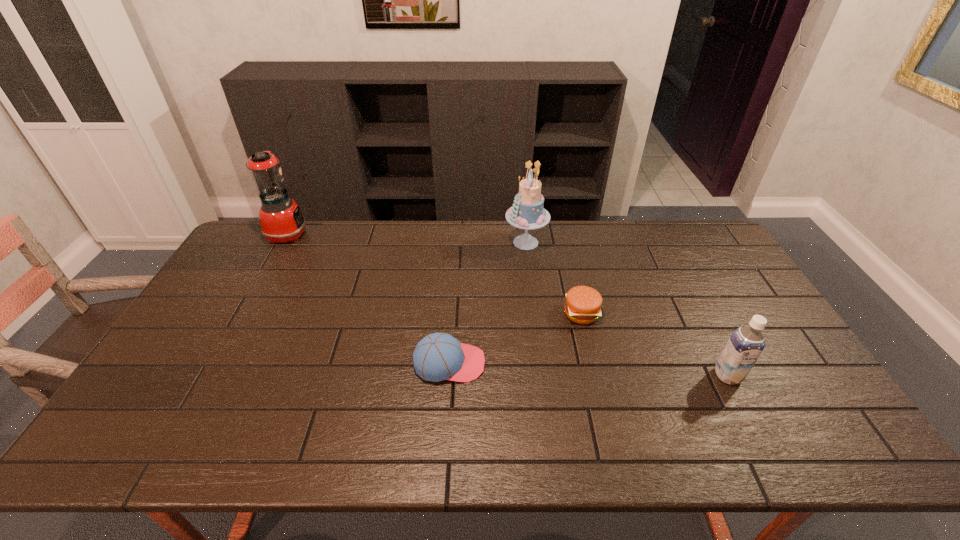
Locate an element on the screen. This screenshot has width=960, height=540. empty location between the third object from left to right and the shortest object is located at coordinates (554, 278).

Identify the location of free area in between the cake and the soya milk. The width and height of the screenshot is (960, 540). (627, 309).

Where is `free space between the leftmost object and the hamburger`? The height and width of the screenshot is (540, 960). free space between the leftmost object and the hamburger is located at coordinates pyautogui.click(x=435, y=273).

Locate an element on the screen. The height and width of the screenshot is (540, 960). vacant space that is in between the second object from left to right and the cake is located at coordinates (488, 303).

Where is `object that can be found as the third closest to the baseball cap`? This screenshot has height=540, width=960. object that can be found as the third closest to the baseball cap is located at coordinates 745,345.

Identify which object is the second closest to the fourth object from right to left. Please provide its 2D coordinates. Your answer should be formatted as a tuple, i.e. [(x, y)], where the tuple contains the x and y coordinates of a point satisfying the conditions above.

[(527, 212)]

The width and height of the screenshot is (960, 540). In order to click on free space that satisfies the following two spatial constraints: 1. on the controls of the leftmost object; 2. on the right side of the third farthest object in this screenshot , I will do `click(243, 313)`.

I want to click on vacant space that satisfies the following two spatial constraints: 1. with a ladder on the side of the third farthest object; 2. on the right side of the cake, so click(x=535, y=313).

Locate an element on the screen. The width and height of the screenshot is (960, 540). free space that satisfies the following two spatial constraints: 1. with a ladder on the side of the hamburger; 2. on the right side of the third object from left to right is located at coordinates (535, 313).

You are a GUI agent. You are given a task and a screenshot of the screen. Output one action in this format:
    pyautogui.click(x=<x>, y=<y>)
    Task: Click on the free spot that satisfies the following two spatial constraints: 1. with a ladder on the side of the cake; 2. on the left side of the shortest object
    
    Given the screenshot: What is the action you would take?
    pyautogui.click(x=535, y=313)